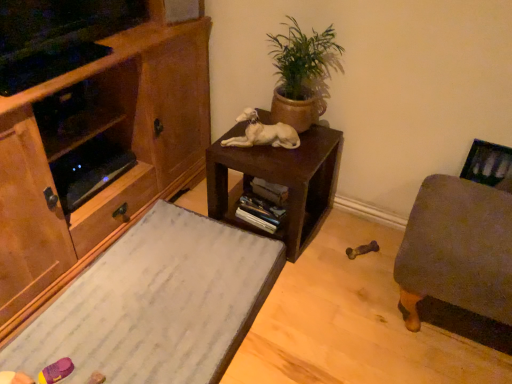
Question: Is green matte pot at upper center further to camera compared to white marble desk at lower left?

Choices:
 (A) no
 (B) yes

Answer: (B)

Question: Is green matte pot at upper center at the right side of white marble desk at lower left?

Choices:
 (A) no
 (B) yes

Answer: (B)

Question: Is green matte pot at upper center placed right next to white marble desk at lower left?

Choices:
 (A) no
 (B) yes

Answer: (A)

Question: From the image's perspective, is green matte pot at upper center over white marble desk at lower left?

Choices:
 (A) no
 (B) yes

Answer: (B)

Question: Considering the relative sizes of green matte pot at upper center and white marble desk at lower left in the image provided, is green matte pot at upper center thinner than white marble desk at lower left?

Choices:
 (A) no
 (B) yes

Answer: (B)

Question: From the image's perspective, is green matte pot at upper center under white marble desk at lower left?

Choices:
 (A) yes
 (B) no

Answer: (B)

Question: Is white glossy statue at center in contact with brown matte table at center?

Choices:
 (A) yes
 (B) no

Answer: (B)

Question: Is white glossy statue at center at the left side of brown matte table at center?

Choices:
 (A) no
 (B) yes

Answer: (B)

Question: Can you confirm if white glossy statue at center is bigger than brown matte table at center?

Choices:
 (A) yes
 (B) no

Answer: (B)

Question: Is white glossy statue at center positioned with its back to brown matte table at center?

Choices:
 (A) yes
 (B) no

Answer: (B)

Question: Is white glossy statue at center far away from brown matte table at center?

Choices:
 (A) no
 (B) yes

Answer: (A)

Question: Is white glossy statue at center smaller than brown matte table at center?

Choices:
 (A) yes
 (B) no

Answer: (A)

Question: From a real-world perspective, is white marble desk at lower left under brown matte table at center?

Choices:
 (A) no
 (B) yes

Answer: (B)